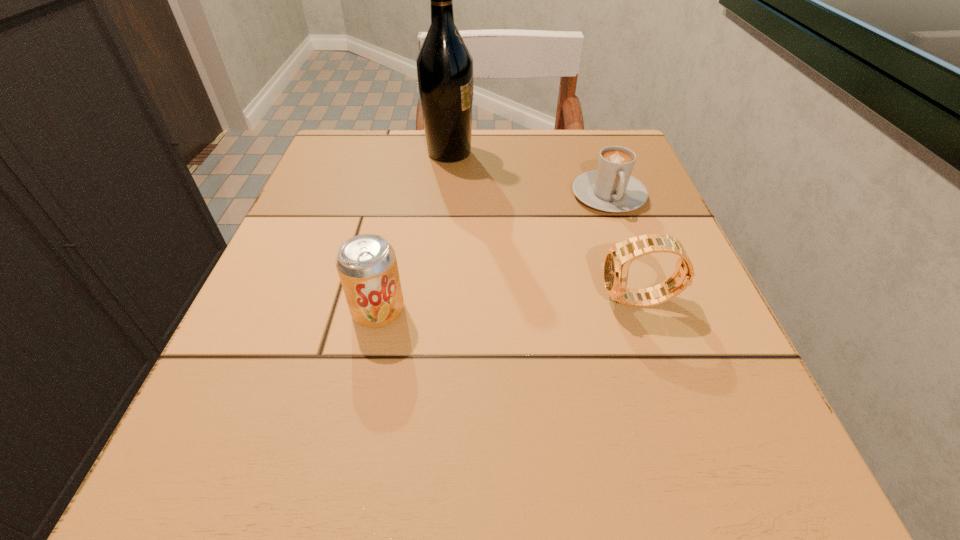
Locate an element on the screen. This screenshot has width=960, height=540. free space at the left edge of the desktop is located at coordinates (337, 323).

The width and height of the screenshot is (960, 540). What are the coordinates of `vacant space at the right edge of the desktop` in the screenshot? It's located at (673, 351).

The height and width of the screenshot is (540, 960). Identify the location of vacant space at the far left corner of the desktop. (358, 179).

Find the location of a particular element. The height and width of the screenshot is (540, 960). free region at the far right corner of the desktop is located at coordinates (567, 160).

Find the location of a particular element. The width and height of the screenshot is (960, 540). empty space between the watch and the pop (soda) is located at coordinates (509, 306).

This screenshot has width=960, height=540. In order to click on free space between the farthest object and the pop (soda) in this screenshot , I will do pos(414,232).

Locate an element on the screen. vacant space that's between the shortest object and the farthest object is located at coordinates (529, 174).

Locate an element on the screen. This screenshot has height=540, width=960. vacant region between the wine bottle and the pop (soda) is located at coordinates (414, 232).

Locate an element on the screen. The width and height of the screenshot is (960, 540). vacant point located between the farthest object and the shortest object is located at coordinates (529, 174).

Where is `blank region between the farthest object and the pop (soda)`? blank region between the farthest object and the pop (soda) is located at coordinates (414, 232).